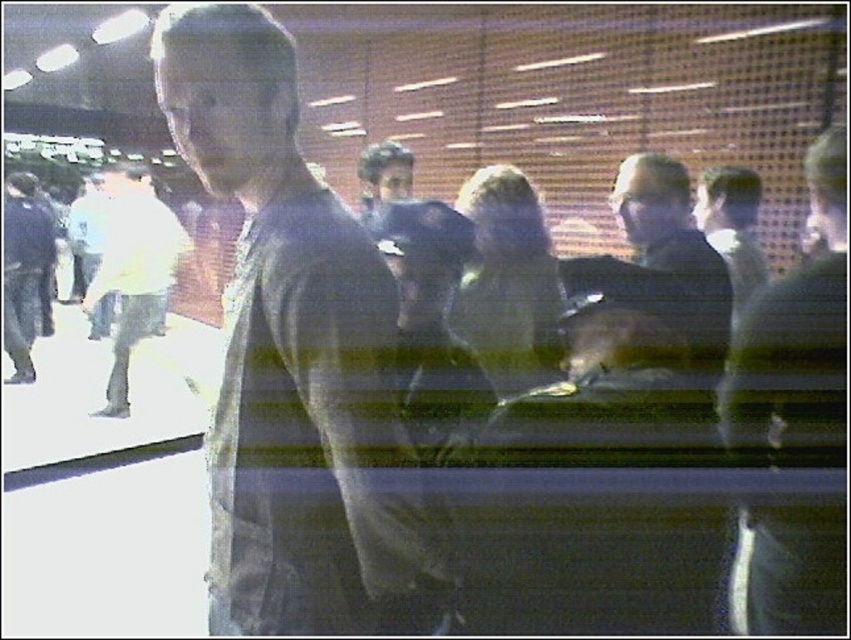
You are a photographer trying to capture a clear image of the dark gray shirt at center and the white matte shirt at left. Since the scene is blurry, you want to adjust your camera settings to reduce motion blur. Which of the two shirts should you focus on first to ensure clarity, considering their sizes?

The dark gray shirt at center is thinner than the white matte shirt at left, so focusing on the dark gray shirt at center first would be better because it is smaller and might require less adjustment to capture clearly.

You are navigating through a crowded transit hub and need to reach a specific location. You notice two points marked in the scene. Which point, point 1 at coordinates (374, 548) or point 2 at coordinates (149, 296), is closer to you as you stand in the foreground near the railing?

Point 1 at coordinates (374, 548) is closer to you because it is in front of point 2 at coordinates (149, 296).

Based on the photo, what are the coordinates of the dark gray shirt at center?

The coordinates of the dark gray shirt at center are at point (294, 358).